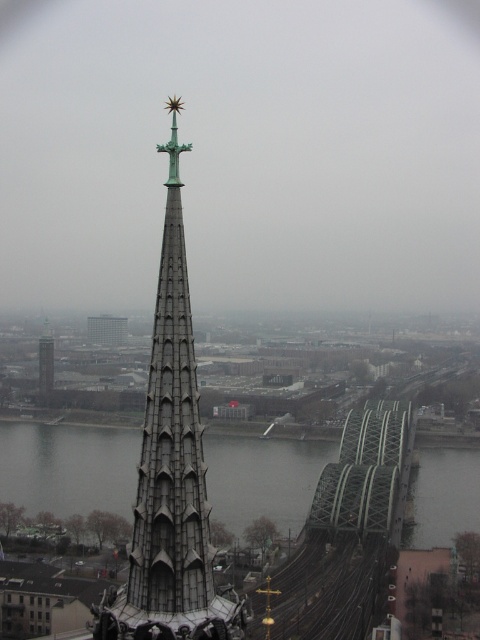
Question: Which point is closer to the camera taking this photo?

Choices:
 (A) (208, 538)
 (B) (69, 508)

Answer: (A)

Question: Does gray stone spire at center appear on the right side of gray metallic water at lower center?

Choices:
 (A) yes
 (B) no

Answer: (B)

Question: Is gray stone spire at center further to camera compared to gray metallic water at lower center?

Choices:
 (A) no
 (B) yes

Answer: (A)

Question: Can you confirm if gray stone spire at center is thinner than gray metallic water at lower center?

Choices:
 (A) yes
 (B) no

Answer: (A)

Question: Among these objects, which one is nearest to the camera?

Choices:
 (A) gray stone spire at center
 (B) gray metallic water at lower center

Answer: (A)

Question: Which object appears farthest from the camera in this image?

Choices:
 (A) gray metallic water at lower center
 (B) gray stone spire at center

Answer: (A)